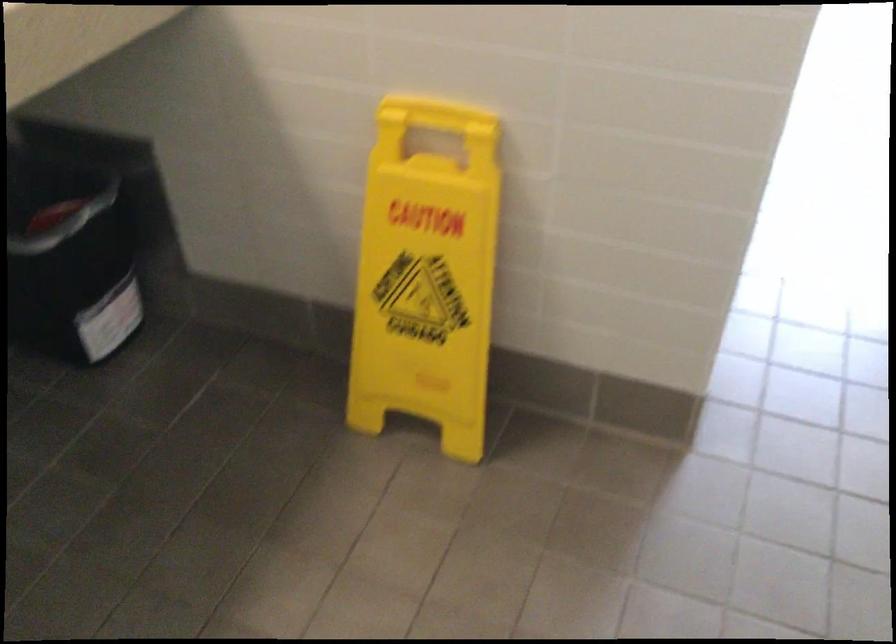
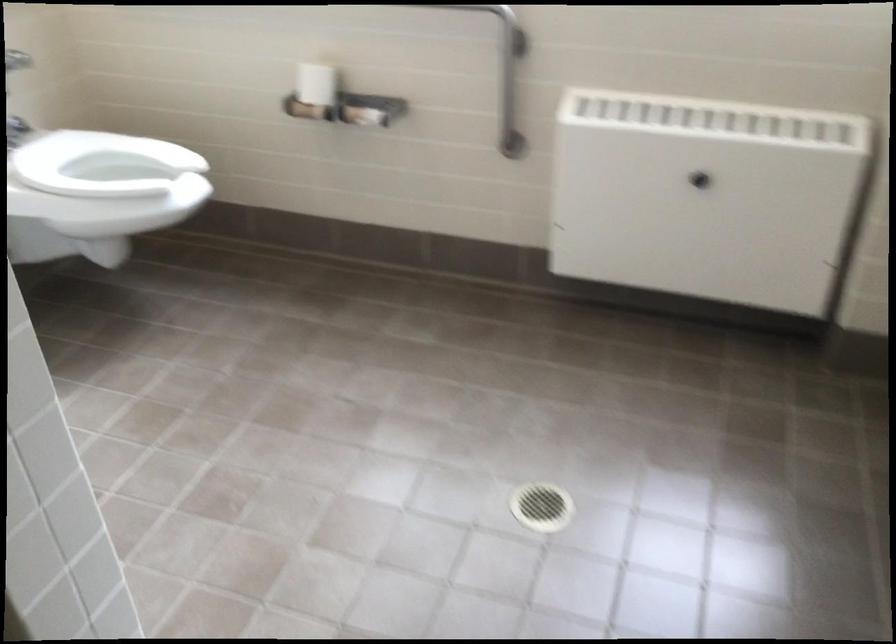
The images are taken continuously from a first-person perspective. In which direction are you moving?

The movement direction of the cameraman is right, forward.